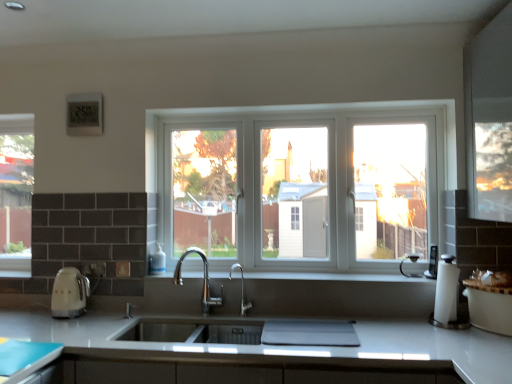
Question: From the image's perspective, is white plastic phone at right, the 2th appliance in the left-to-right sequence, on top of white plastic window at center, placed as the first window when sorted from front to back?

Choices:
 (A) yes
 (B) no

Answer: (B)

Question: From a real-world perspective, is white plastic phone at right, the 2th appliance in the left-to-right sequence, physically below white plastic window at center, the 2th window from the left?

Choices:
 (A) no
 (B) yes

Answer: (B)

Question: Can you confirm if white plastic phone at right, which ranks as the 1th appliance in right-to-left order, is bigger than white plastic window at center, which appears as the first window when viewed from the right?

Choices:
 (A) no
 (B) yes

Answer: (A)

Question: Is white plastic phone at right, the 2th appliance in the left-to-right sequence, smaller than white plastic window at center, which appears as the 2th window when viewed from the back?

Choices:
 (A) no
 (B) yes

Answer: (B)

Question: Does white plastic phone at right, the 2th appliance in the left-to-right sequence, have a lesser height compared to white plastic window at center, placed as the first window when sorted from front to back?

Choices:
 (A) no
 (B) yes

Answer: (B)

Question: Does white plastic phone at right, the 2th appliance in the left-to-right sequence, have a lesser width compared to white plastic window at center, the 2th window from the left?

Choices:
 (A) yes
 (B) no

Answer: (B)

Question: From the image's perspective, does clear glass window at left, the 2th window positioned from the front, appear higher than white glossy coffee machine at right?

Choices:
 (A) yes
 (B) no

Answer: (A)

Question: From a real-world perspective, does clear glass window at left, the 2th window positioned from the front, stand above white glossy coffee machine at right?

Choices:
 (A) no
 (B) yes

Answer: (B)

Question: Is clear glass window at left, positioned as the first window in left-to-right order, outside white glossy coffee machine at right?

Choices:
 (A) yes
 (B) no

Answer: (A)

Question: Is clear glass window at left, positioned as the first window in left-to-right order, thinner than white glossy coffee machine at right?

Choices:
 (A) no
 (B) yes

Answer: (B)

Question: From a real-world perspective, does clear glass window at left, the second window viewed from the right, sit lower than white glossy coffee machine at right?

Choices:
 (A) no
 (B) yes

Answer: (A)

Question: Considering the relative sizes of clear glass window at left, the second window viewed from the right, and white glossy coffee machine at right in the image provided, is clear glass window at left, the second window viewed from the right, smaller than white glossy coffee machine at right?

Choices:
 (A) yes
 (B) no

Answer: (B)

Question: Does white smooth window sill at center have a greater width compared to matte cream kettle at left, arranged as the 2th appliance when viewed from the right?

Choices:
 (A) no
 (B) yes

Answer: (B)